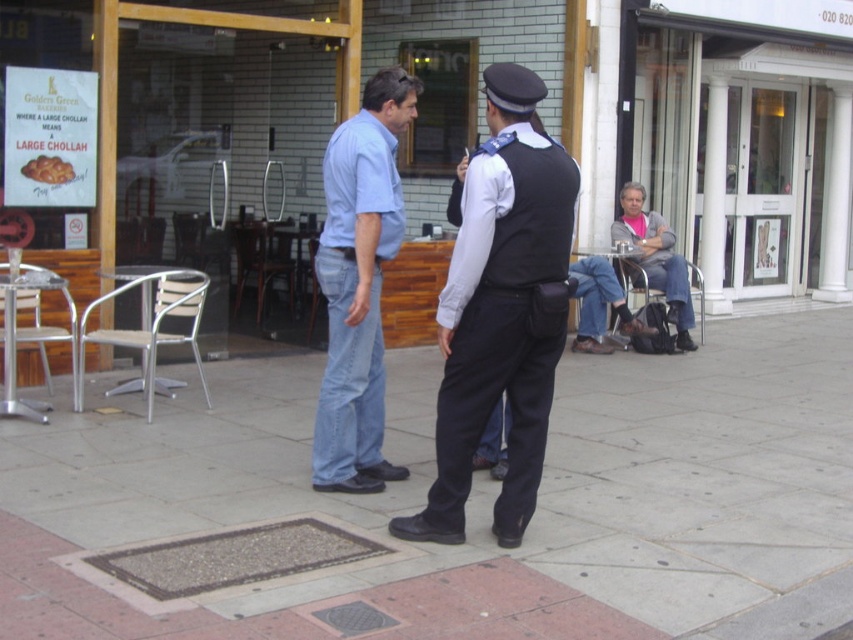
Is smooth concrete pavement at center above dark blue fabric vest at center?

No.

Which is behind, point (331, 500) or point (463, 248)?

Positioned behind is point (331, 500).

The height and width of the screenshot is (640, 853). Identify the location of smooth concrete pavement at center. (467, 502).

Is white glass door at upper right to the left of light blue denim jeans at center from the viewer's perspective?

No, white glass door at upper right is not to the left of light blue denim jeans at center.

Which is behind, point (811, 113) or point (361, 433)?

Positioned behind is point (811, 113).

This screenshot has height=640, width=853. Find the location of `white glass door at upper right`. white glass door at upper right is located at coordinates (743, 138).

In the scene shown: Is white glass door at upper right shorter than gray sweater at right?

In fact, white glass door at upper right may be taller than gray sweater at right.

This screenshot has height=640, width=853. I want to click on white glass door at upper right, so click(x=743, y=138).